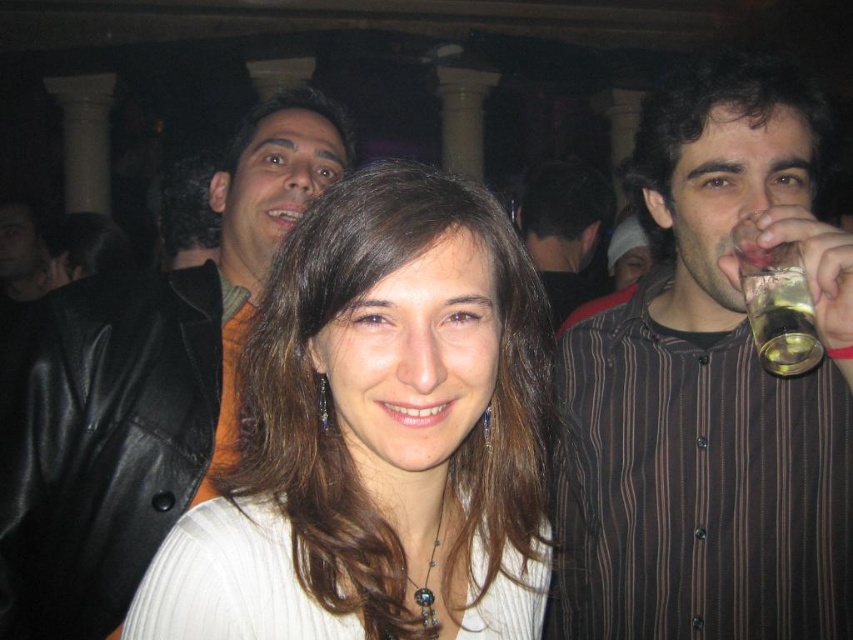
Measure the distance between white matte sweater at center and dark brown hair at left.

A distance of 5.47 feet exists between white matte sweater at center and dark brown hair at left.

Can you confirm if white matte sweater at center is positioned to the left of dark brown hair at left?

Incorrect, white matte sweater at center is not on the left side of dark brown hair at left.

Where is `white matte sweater at center`? This screenshot has height=640, width=853. white matte sweater at center is located at coordinates (378, 435).

In the scene shown: Which is below, brown striped shirt at right or matte black shirt at upper center?

brown striped shirt at right is below.

Measure the distance between point (x=630, y=616) and camera.

Point (x=630, y=616) is 1.56 meters from camera.

Find the location of `brown striped shirt at right`. brown striped shirt at right is located at coordinates (709, 390).

Which is more to the right, brown striped shirt at right or dark brown hair at left?

brown striped shirt at right

Does brown striped shirt at right appear over dark brown hair at left?

Incorrect, brown striped shirt at right is not positioned above dark brown hair at left.

Measure the distance between point (805,157) and camera.

Point (805,157) and camera are 1.39 meters apart from each other.

This screenshot has width=853, height=640. Find the location of `brown striped shirt at right`. brown striped shirt at right is located at coordinates (709, 390).